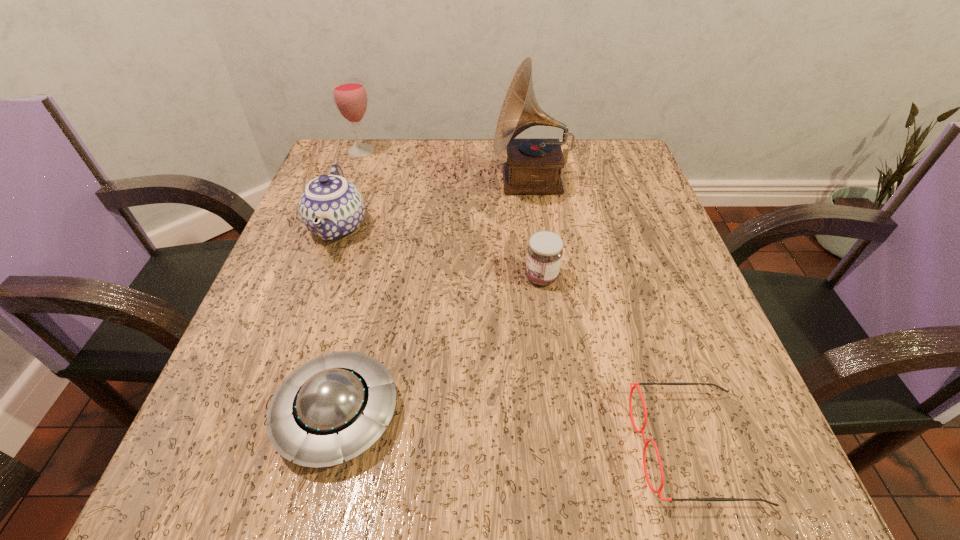
Identify the location of unoccupied position between the second tallest object and the third nearest object. (451, 214).

You are a GUI agent. You are given a task and a screenshot of the screen. Output one action in this format:
    pyautogui.click(x=<x>, y=<y>)
    Task: Click on the free space between the rightmost object and the phonograph record
    This screenshot has width=960, height=540.
    Given the screenshot: What is the action you would take?
    pyautogui.click(x=612, y=314)

What are the coordinates of `empty location between the fourth farthest object and the wineglass` in the screenshot? It's located at (451, 214).

Where is `vacant space that is in between the spectacles and the saucer`? vacant space that is in between the spectacles and the saucer is located at coordinates coord(516,430).

I want to click on unoccupied area between the saucer and the phonograph record, so click(x=434, y=298).

Identify the location of object identified as the fourth closest to the wineglass. This screenshot has width=960, height=540. (334, 407).

Locate an element on the screen. This screenshot has height=540, width=960. the second closest object to the tallest object is located at coordinates (331, 207).